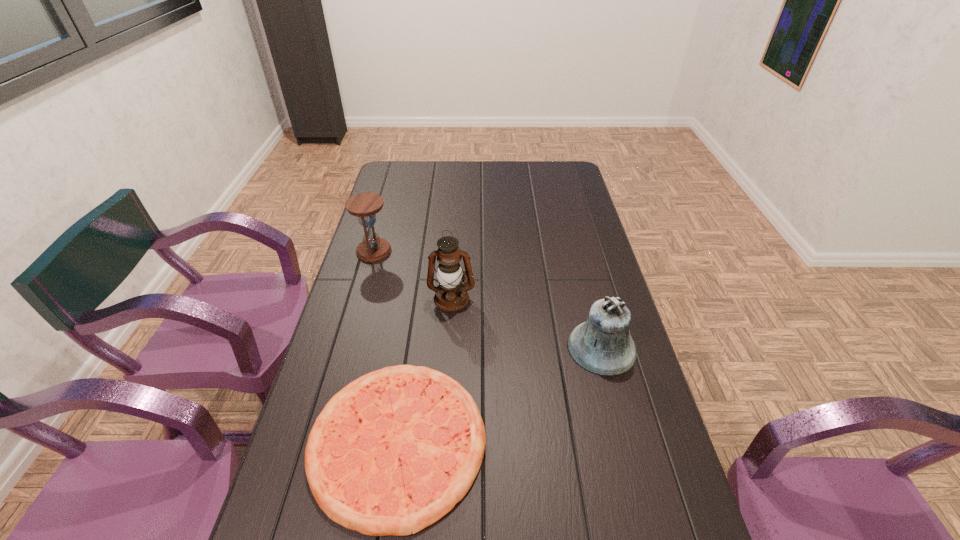
What are the coordinates of `lantern` in the screenshot? It's located at (449, 273).

Find the location of a particular element. the second farthest object is located at coordinates (449, 273).

Find the location of a particular element. The width and height of the screenshot is (960, 540). the farthest object is located at coordinates (364, 206).

Identify the location of the rightmost object. Image resolution: width=960 pixels, height=540 pixels. (602, 345).

This screenshot has width=960, height=540. Find the location of `the shortest object`. the shortest object is located at coordinates (361, 452).

This screenshot has height=540, width=960. I want to click on vacant point located on the side of the tallest object, there is a wick adjustment knob, so click(450, 323).

Locate an element on the screen. Image resolution: width=960 pixels, height=540 pixels. vacant region located 0.180m on the right of the farthest object is located at coordinates (442, 251).

Identify the location of vacant space located on the back of the rightmost object. Image resolution: width=960 pixels, height=540 pixels. (584, 278).

Find the location of a particular element. The image size is (960, 540). vacant space located on the back of the pizza is located at coordinates pyautogui.click(x=421, y=279).

What are the coordinates of `hourglass that is at the left edge` in the screenshot? It's located at (364, 206).